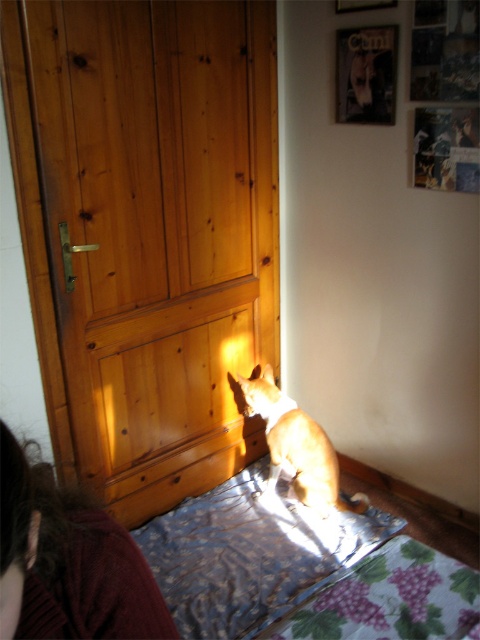
Question: Can you confirm if wooden door at center is thinner than metallic silver bed at center?

Choices:
 (A) yes
 (B) no

Answer: (A)

Question: Is brown woolen sweater at lower left in front of brown fur cat at center?

Choices:
 (A) no
 (B) yes

Answer: (B)

Question: Where is metallic silver bed at center located in relation to brown fur cat at center in the image?

Choices:
 (A) above
 (B) below

Answer: (B)

Question: Among these objects, which one is farthest from the camera?

Choices:
 (A) wooden door at center
 (B) brown woolen sweater at lower left
 (C) brown fur cat at center

Answer: (C)

Question: Based on their relative distances, which object is nearer to the metallic silver bed at center?

Choices:
 (A) brown fur cat at center
 (B) wooden door at center

Answer: (A)

Question: Which of the following is the farthest from the observer?

Choices:
 (A) brown fur cat at center
 (B) wooden door at center
 (C) brown woolen sweater at lower left

Answer: (A)